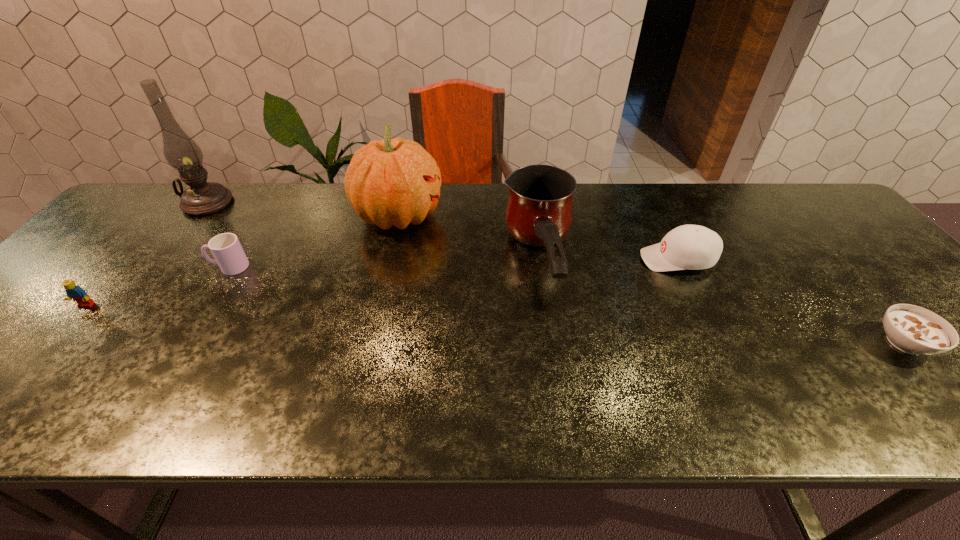
At what (x,y) coordinates should I click in order to perform the action: click on free space located on the front of the oil lamp. Please return your answer as a coordinate pair (x, y). Looking at the image, I should click on (146, 282).

Identify the location of vacant space situated 0.190m on the carved face of the pumpkin. The height and width of the screenshot is (540, 960). (507, 215).

In order to click on vacant region located 0.090m on the handle side of the saucepan in this screenshot , I will do `click(555, 366)`.

Where is `blank space located on the front-facing side of the baseball cap`? The image size is (960, 540). blank space located on the front-facing side of the baseball cap is located at coordinates (611, 259).

Identify the location of vacant point located 0.310m on the front-facing side of the baseball cap. point(523,259).

Locate an element on the screen. Image resolution: width=960 pixels, height=540 pixels. vacant region located on the front-facing side of the baseball cap is located at coordinates (618, 259).

This screenshot has width=960, height=540. In order to click on free space located with the handle on the side of the cup in this screenshot , I will do `click(149, 267)`.

Identify the location of vacant area located with the handle on the side of the cup. The width and height of the screenshot is (960, 540). (130, 267).

The image size is (960, 540). What are the coordinates of `vacant region located with the handle on the side of the cup` in the screenshot? It's located at (113, 267).

The width and height of the screenshot is (960, 540). What are the coordinates of `vacant space situated 0.110m on the face of the Lego` in the screenshot? It's located at (50, 347).